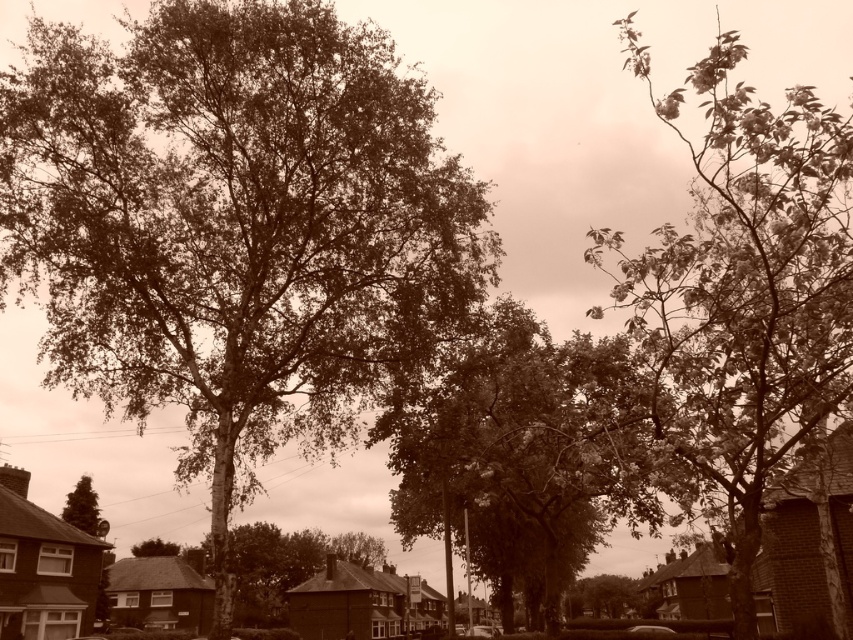
In the scene shown: You are standing at the center of the street and want to visit both the green leafy tree at center and the green leafy tree at lower left. Which tree should you visit first to minimize the total distance walked?

You should visit the green leafy tree at center first because it is closer to your starting position at the center of the street than the green leafy tree at lower left, so visiting it first minimizes the total distance walked.

What are the coordinates of the green leafy tree at center?

The green leafy tree at center is located at coordinates point (234, 227).